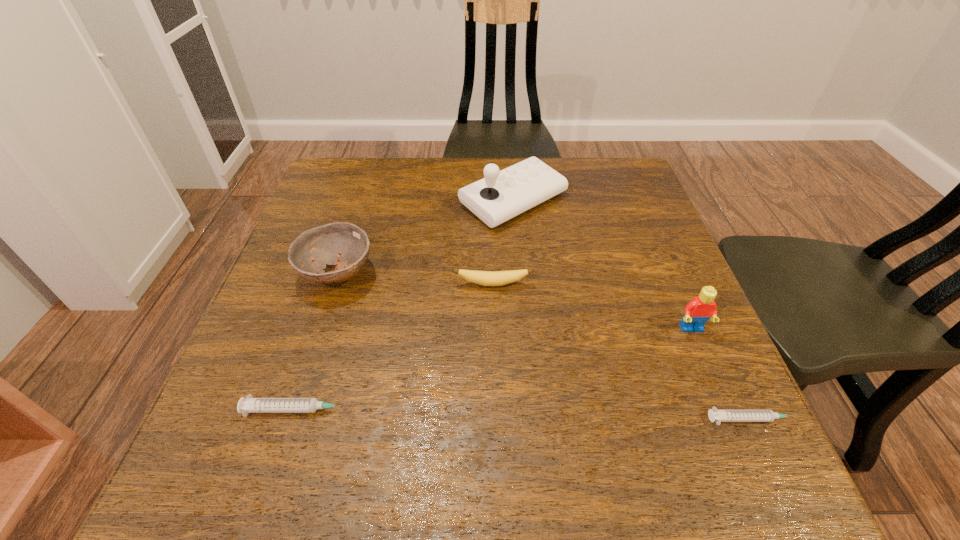
Locate an element on the screen. Image resolution: width=960 pixels, height=540 pixels. the left syringe is located at coordinates (249, 405).

You are a GUI agent. You are given a task and a screenshot of the screen. Output one action in this format:
    pyautogui.click(x=<x>, y=<y>)
    Task: Click on the second shortest object
    
    Given the screenshot: What is the action you would take?
    pyautogui.click(x=249, y=405)

Locate an element on the screen. This screenshot has width=960, height=540. the right syringe is located at coordinates (718, 416).

Find the location of `the shorter syringe`. the shorter syringe is located at coordinates (718, 416).

The image size is (960, 540). In order to click on the tallest object in this screenshot , I will do `click(502, 195)`.

This screenshot has width=960, height=540. I want to click on joystick, so click(x=502, y=195).

The width and height of the screenshot is (960, 540). Find the location of `bowl`. bowl is located at coordinates (323, 244).

At what (x,y) coordinates should I click in order to perform the action: click on Lego. Please return your answer as a coordinate pair (x, y). The height and width of the screenshot is (540, 960). Looking at the image, I should click on (697, 312).

This screenshot has height=540, width=960. What are the coordinates of `the third nearest object` in the screenshot? It's located at (697, 312).

The image size is (960, 540). What are the coordinates of `the third shortest object` in the screenshot? It's located at (486, 278).